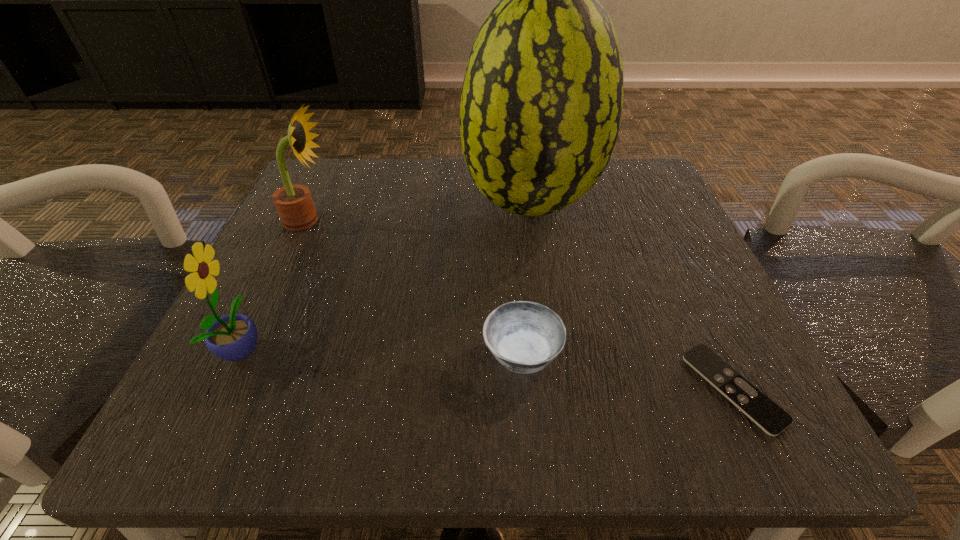
The image size is (960, 540). I want to click on the tallest object, so click(541, 104).

Identify the location of the taller sunflower. click(x=294, y=204).

Where is `the second tallest object`? the second tallest object is located at coordinates (294, 204).

Where is `the shorter sunflower`? Image resolution: width=960 pixels, height=540 pixels. the shorter sunflower is located at coordinates (233, 337).

Locate an element on the screen. the nearer sunflower is located at coordinates (233, 337).

Find the location of a particular element. Image resolution: width=960 pixels, height=540 pixels. the fourth tallest object is located at coordinates (525, 337).

This screenshot has width=960, height=540. I want to click on the shortest object, so click(772, 419).

You are a GUI agent. You are given a task and a screenshot of the screen. Output one action in this format:
    pyautogui.click(x=<x>, y=<y>)
    Task: Click on the remote control
    The image size is (960, 540).
    Given the screenshot: What is the action you would take?
    pyautogui.click(x=772, y=419)

The width and height of the screenshot is (960, 540). I want to click on free point located on the left of the watermelon, so click(x=300, y=205).

Where is `free space located 0.130m on the face of the taller sunflower`? free space located 0.130m on the face of the taller sunflower is located at coordinates click(x=402, y=220).